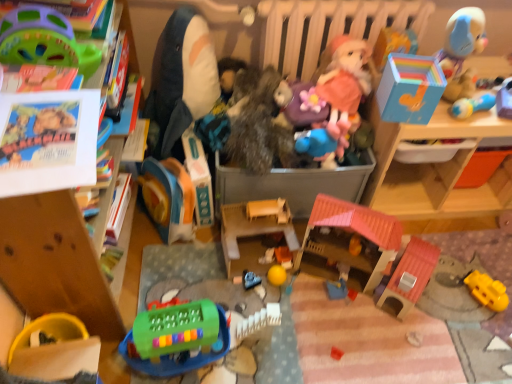
I want to click on free point behind smooth blue car at center, the eleventh toy in the right-to-left sequence, so click(256, 256).